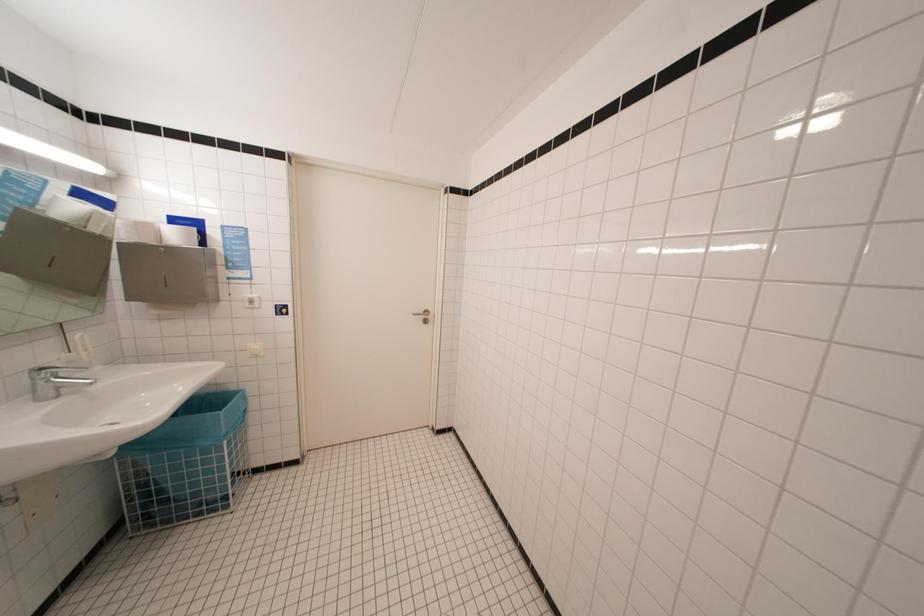
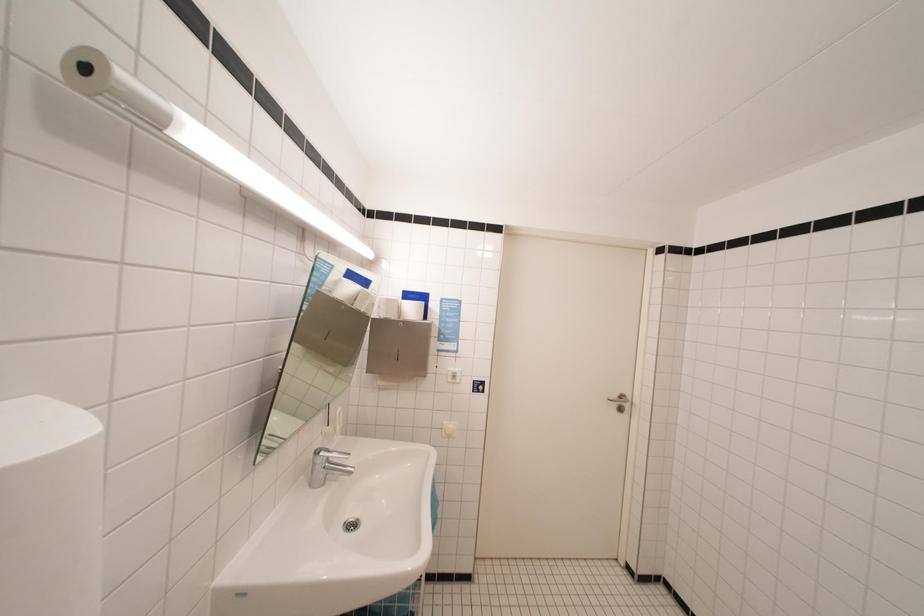
Question: In a continuous first-person perspective shot, in which direction is the camera moving?

Choices:
 (A) Left
 (B) Right
 (C) Forward
 (D) Backward

Answer: (A)